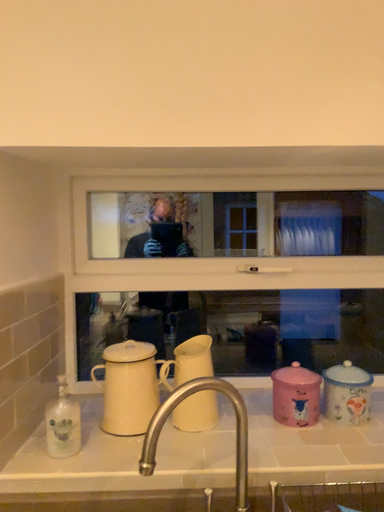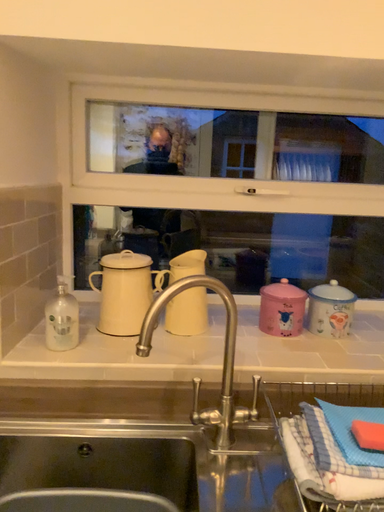
Question: Which way did the camera rotate in the video?

Choices:
 (A) rotated upward
 (B) rotated downward

Answer: (B)